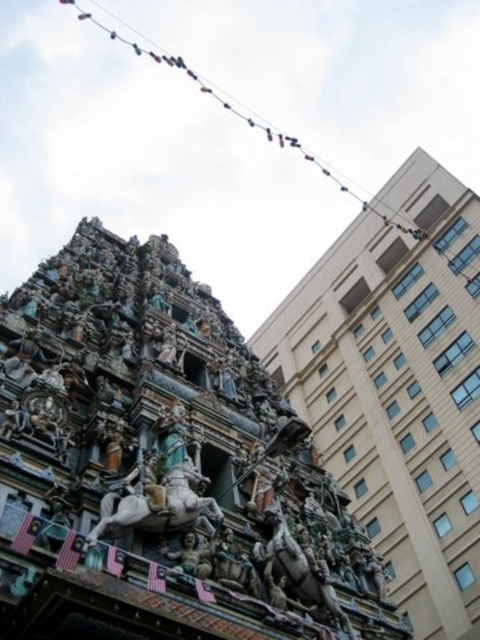
You are standing at a viewpoint where you can see both the temple on the left and the modern highrise on the right. A point at coordinates point (282, 385) is visible in your line of sight. If you want to place a new sculpture exactly at that point, how far in feet would you need to walk from your current position to reach it?

The distance of point (282, 385) from camera is 511.92 feet, so you would need to walk 511.92 feet to reach it.

You are an architect analyzing the spatial relationship between the carved stone hindu temple at center and the polished bronze horse at center. Which object is placed higher in the image?

The carved stone hindu temple at center is positioned over the polished bronze horse at center, so it is higher.

You are standing in front of the temple structure on the left and want to take a photo of both the temple and the modern highrise building on the right. You notice two points marked in the image at coordinates point (348, 422) and point (129, 488). Which of these points is closer to your camera position?

Point (129, 488) is closer to the camera because it is less further than point (348, 422).